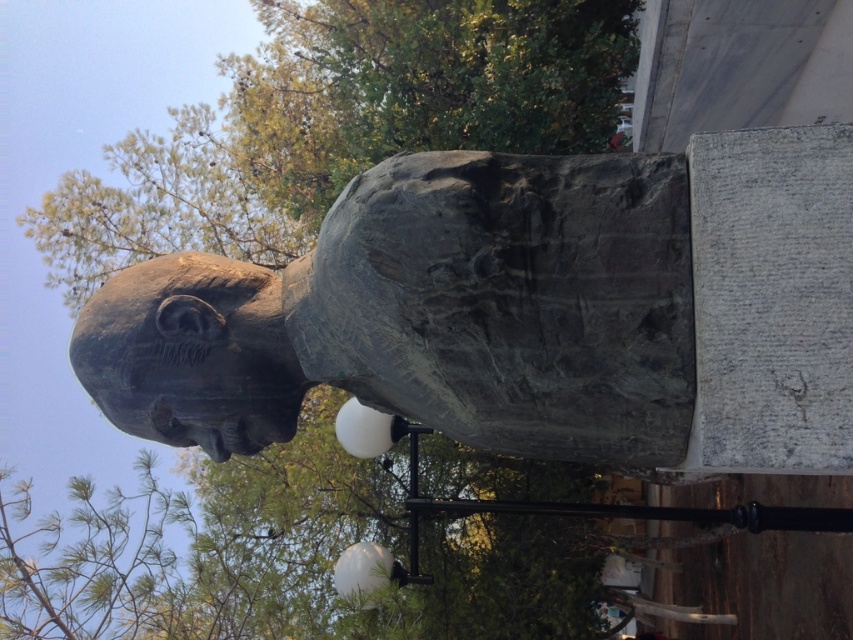
Is bronze statue at center to the right of bronze sculpture at center from the viewer's perspective?

Yes, bronze statue at center is to the right of bronze sculpture at center.

Which is above, bronze statue at center or bronze sculpture at center?

bronze statue at center is higher up.

Does point (621, 305) come closer to viewer compared to point (117, 348)?

Yes, it is in front of point (117, 348).

This screenshot has height=640, width=853. I want to click on bronze statue at center, so click(428, 316).